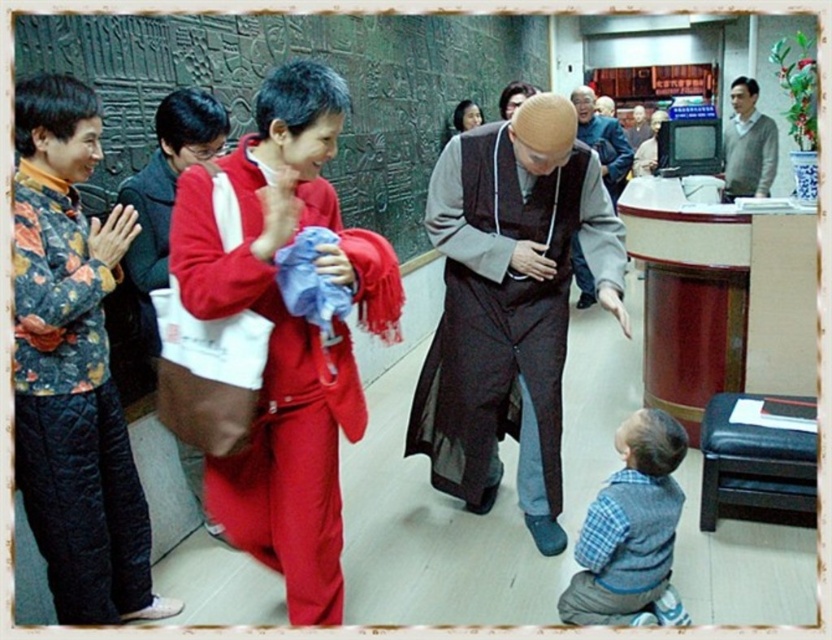
Is matte red robe at center thinner than matte black robe at center?

Incorrect, matte red robe at center's width is not less than matte black robe at center's.

The image size is (832, 640). What are the coordinates of `matte red robe at center` in the screenshot? It's located at (266, 396).

Describe the element at coordinates (266, 396) in the screenshot. The height and width of the screenshot is (640, 832). I see `matte red robe at center` at that location.

Find the location of a particular element. This screenshot has height=640, width=832. matte red robe at center is located at coordinates pos(266,396).

Can you confirm if brown matte robe at center is positioned to the right of smooth brown wooden table at center?

In fact, brown matte robe at center is to the left of smooth brown wooden table at center.

Is brown matte robe at center above smooth brown wooden table at center?

Incorrect, brown matte robe at center is not positioned above smooth brown wooden table at center.

Does point (508, 134) come behind point (647, 136)?

No.

Locate an element on the screen. The height and width of the screenshot is (640, 832). brown matte robe at center is located at coordinates (504, 308).

Is the position of floral quilted robe at left less distant than that of matte red robe at center?

No, it is behind matte red robe at center.

Is floral quilted robe at left below matte red robe at center?

Yes.

Who is more forward, (106,392) or (182,296)?

Point (182,296) is more forward.

At what (x,y) coordinates should I click in order to perform the action: click on floral quilted robe at left. Please return your answer as a coordinate pair (x, y). Looking at the image, I should click on (72, 413).